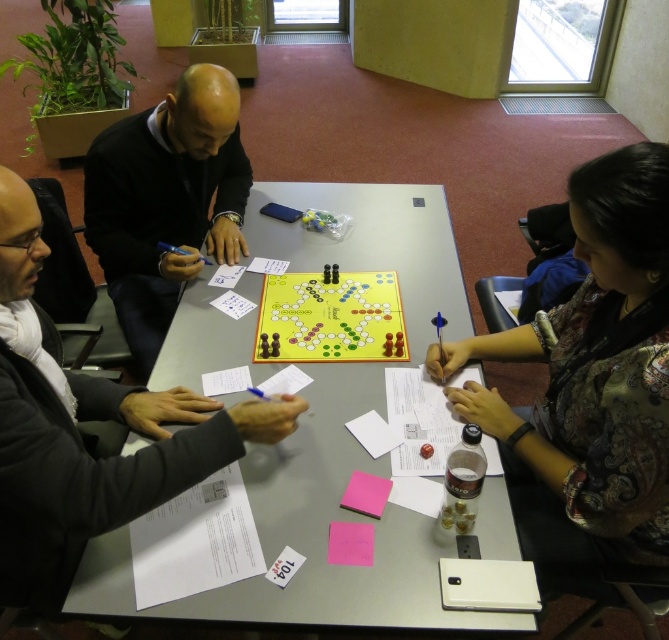
Is smooth plastic table at center to the left of dark gray sweater at left from the viewer's perspective?

Incorrect, smooth plastic table at center is not on the left side of dark gray sweater at left.

Which is behind, point (407, 579) or point (205, 440)?

The point (205, 440) is more distant.

I want to click on smooth plastic table at center, so click(330, 442).

Is dark gray sweater at left positioned in front of yellow matte board game at center?

That is True.

Who is higher up, dark gray sweater at left or yellow matte board game at center?

yellow matte board game at center

Who is more forward, [43,518] or [286,355]?

Point [43,518] is more forward.

The height and width of the screenshot is (640, 669). In order to click on dark gray sweater at left in this screenshot , I will do `click(82, 440)`.

Is floral silk blouse at right below yellow matte board game at center?

Correct, floral silk blouse at right is located below yellow matte board game at center.

Find the location of a particular element. The height and width of the screenshot is (640, 669). floral silk blouse at right is located at coordinates (595, 362).

The height and width of the screenshot is (640, 669). I want to click on floral silk blouse at right, so click(x=595, y=362).